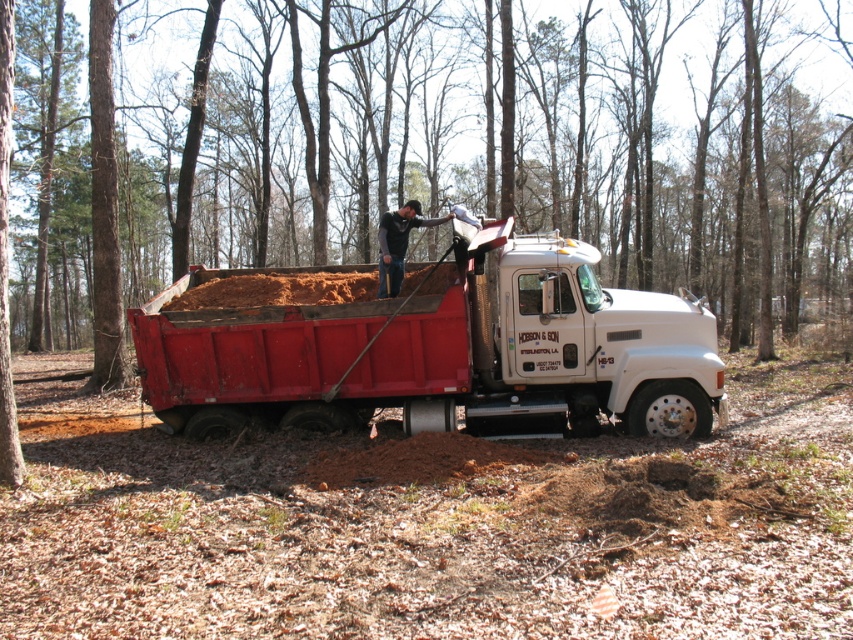
You are a delivery driver who needs to park your truck next to the dump truck. The width of your truck is the same as the dark gray jeans at center. Will your truck fit next to the matte red dump truck at center without overlapping?

The matte red dump truck at center is wider than the dark gray jeans at center. Since your truck has the same width as the dark gray jeans at center, it may not fit next to the matte red dump truck at center without overlapping, as the dump truck is wider.

You are standing next to the matte red dump truck at center and want to reach the brown bark tree at center. Considering the distance between them, can you walk directly to the tree without needing to go around any obstacles?

The brown bark tree at center is 32.99 meters away from the matte red dump truck at center. Since there are no obstacles mentioned in the scene description, you can walk directly to the tree.

You are a safety inspector observing the scene. The brown bark tree at center and the dark gray jeans at center are both in your line of sight. According to the safety guidelines, you must ensure that no part of the tree is directly above any worker. Is there a safety violation here?

The brown bark tree at center is above the dark gray jeans at center, which means the tree is directly over the worker, violating safety guidelines. A violation exists.